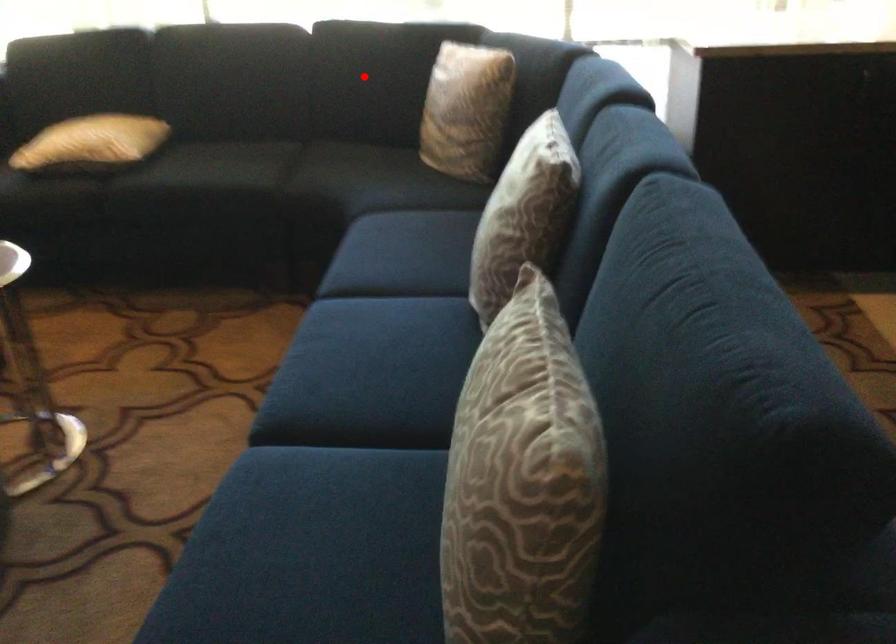
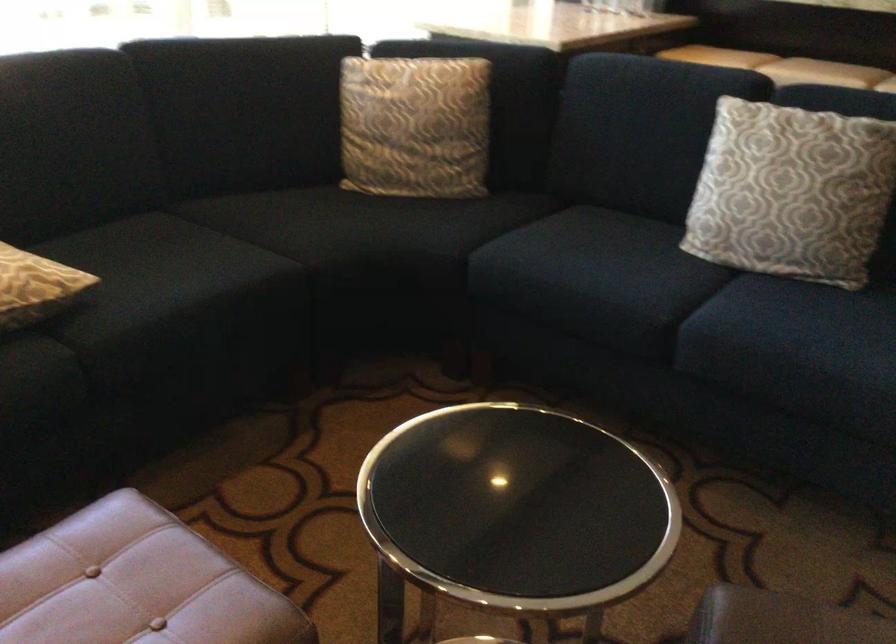
Question: I am providing you with two images of the same scene from different viewpoints. A red point is shown in image1. For the corresponding object point in image2, is it positioned nearer or farther from the camera?

Choices:
 (A) Nearer
 (B) Farther

Answer: (A)